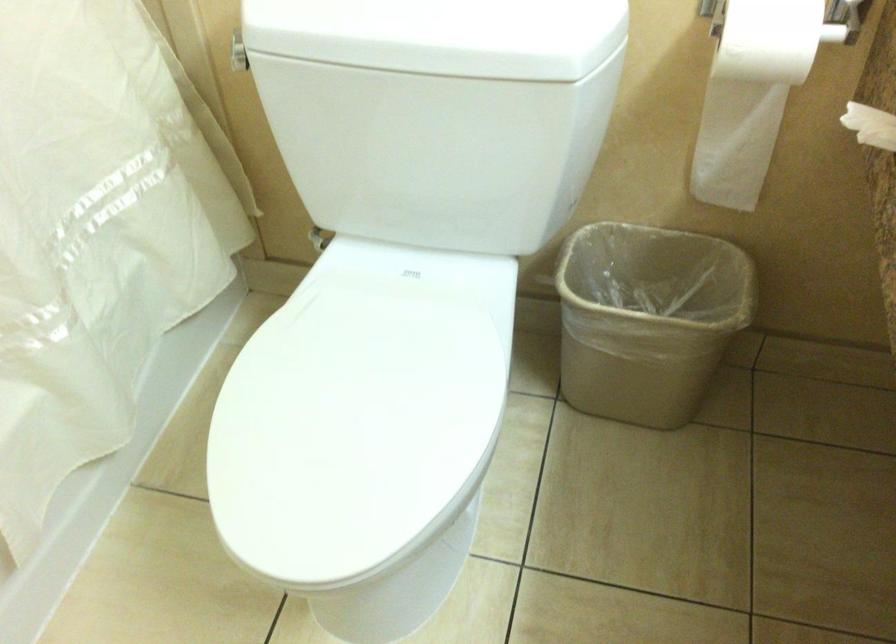
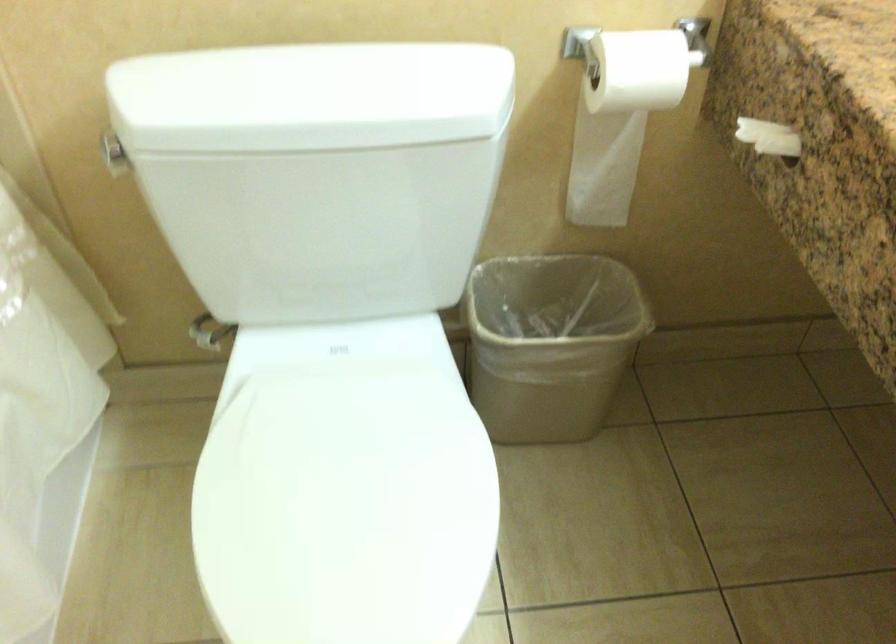
Question: In a continuous first-person perspective shot, in which direction is the camera moving?

Choices:
 (A) Left
 (B) Right
 (C) Forward
 (D) Backward

Answer: (A)